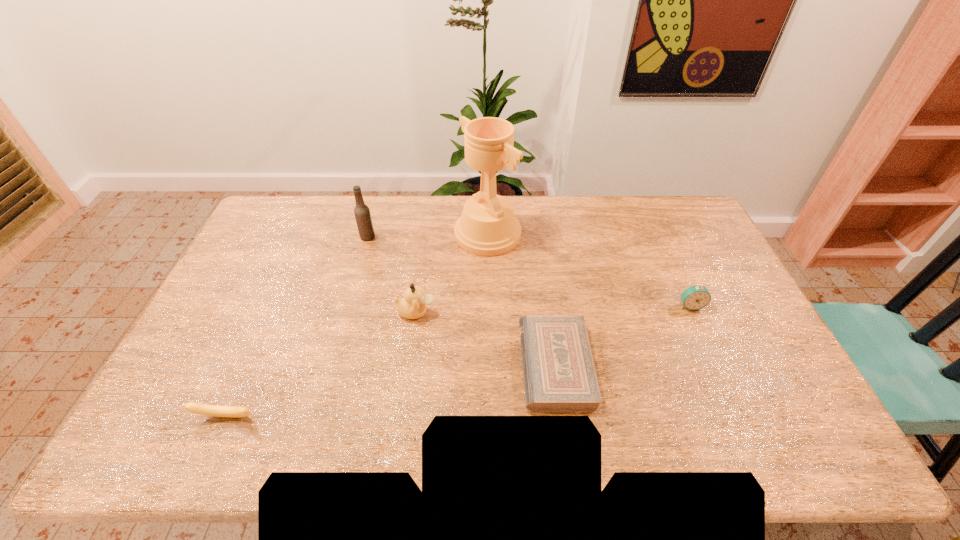
The width and height of the screenshot is (960, 540). I want to click on award, so click(x=487, y=227).

Where is `the second object from left to right`? Image resolution: width=960 pixels, height=540 pixels. the second object from left to right is located at coordinates (362, 213).

What are the coordinates of `the fifth shortest object` in the screenshot? It's located at (362, 213).

You are a GUI agent. You are given a task and a screenshot of the screen. Output one action in this format:
    pyautogui.click(x=<x>, y=<y>)
    Task: Click on the fourth object from right to left
    
    Given the screenshot: What is the action you would take?
    pyautogui.click(x=413, y=306)

This screenshot has height=540, width=960. Find the location of `the fourth shortest object`. the fourth shortest object is located at coordinates (413, 306).

Identify the location of the rightmost object. (696, 297).

Identify the location of alarm clock. The width and height of the screenshot is (960, 540). (696, 297).

Find the location of a particular element. Image resolution: width=960 pixels, height=540 pixels. banana is located at coordinates (198, 408).

Find the location of a particular element. the fifth tallest object is located at coordinates (198, 408).

The height and width of the screenshot is (540, 960). Identify the location of Bible. (559, 374).